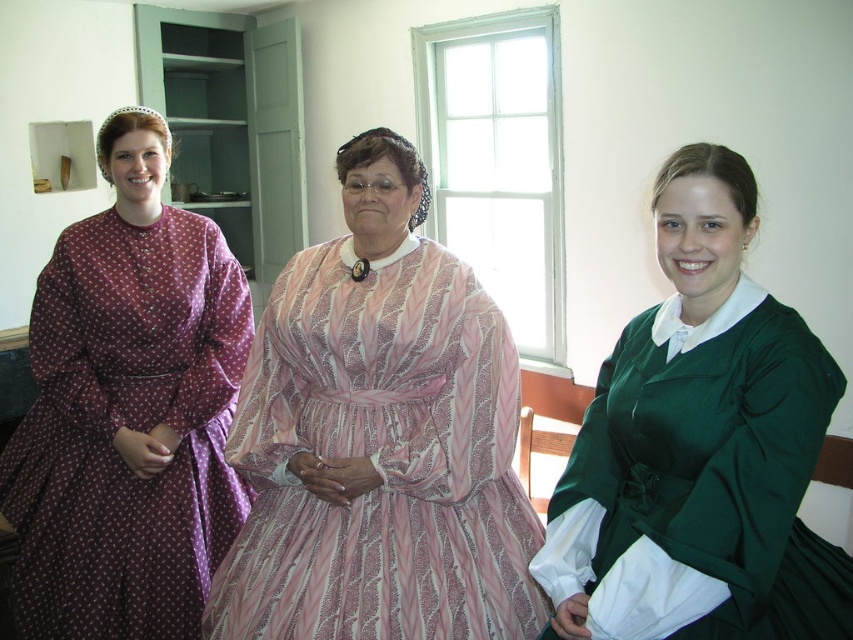
Does green satin dress at center have a lesser height compared to purple printed dress at left?

Yes.

Between point (834, 609) and point (202, 572), which one is positioned behind?

The point (202, 572) is more distant.

You are a GUI agent. You are given a task and a screenshot of the screen. Output one action in this format:
    pyautogui.click(x=<x>, y=<y>)
    Task: Click on the green satin dress at center
    
    Given the screenshot: What is the action you would take?
    pyautogui.click(x=699, y=448)

The height and width of the screenshot is (640, 853). In order to click on pink satin dress at center in this screenshot , I will do `click(378, 436)`.

Is pink satin dress at center above purple printed dress at left?

Actually, pink satin dress at center is below purple printed dress at left.

Describe the element at coordinates (378, 436) in the screenshot. The height and width of the screenshot is (640, 853). I see `pink satin dress at center` at that location.

Where is `pink satin dress at center`? The height and width of the screenshot is (640, 853). pink satin dress at center is located at coordinates (378, 436).

In the scene shown: Who is lower down, pink satin dress at center or green satin dress at center?

green satin dress at center

Can you confirm if pink satin dress at center is bigger than green satin dress at center?

Correct, pink satin dress at center is larger in size than green satin dress at center.

This screenshot has width=853, height=640. Describe the element at coordinates (378, 436) in the screenshot. I see `pink satin dress at center` at that location.

Find the location of `pink satin dress at center`. pink satin dress at center is located at coordinates (378, 436).